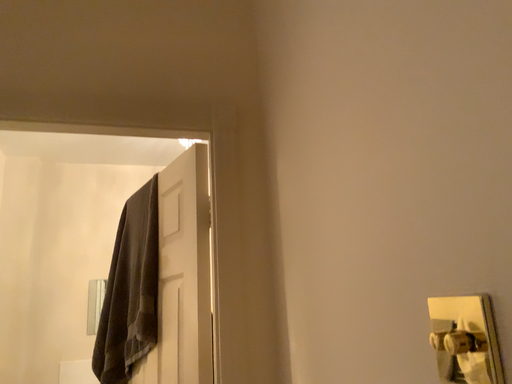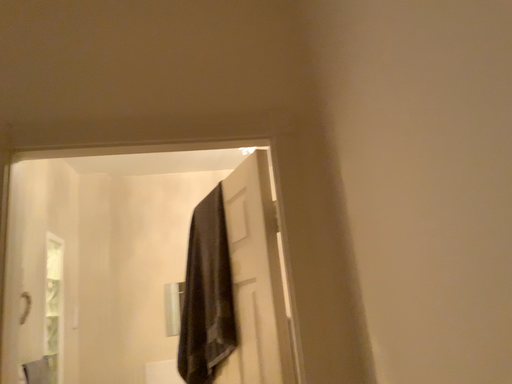
Question: Which way did the camera rotate in the video?

Choices:
 (A) rotated left
 (B) rotated right

Answer: (A)